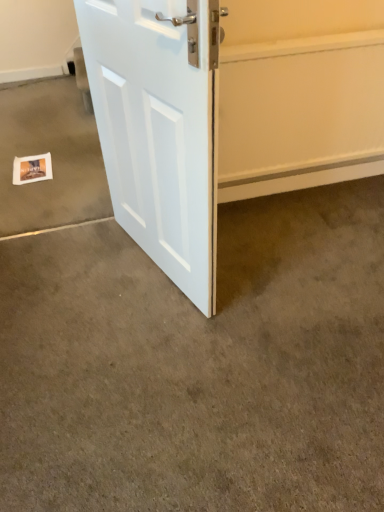
Question: Can you confirm if white paper postcard at lower left is taller than white smooth door at upper center?

Choices:
 (A) yes
 (B) no

Answer: (B)

Question: Considering the relative sizes of white paper postcard at lower left and white smooth door at upper center in the image provided, is white paper postcard at lower left thinner than white smooth door at upper center?

Choices:
 (A) no
 (B) yes

Answer: (A)

Question: Is white paper postcard at lower left far from white smooth door at upper center?

Choices:
 (A) no
 (B) yes

Answer: (B)

Question: Would you say white smooth door at upper center is part of white paper postcard at lower left's contents?

Choices:
 (A) yes
 (B) no

Answer: (B)

Question: Is white paper postcard at lower left at the right side of white smooth door at upper center?

Choices:
 (A) yes
 (B) no

Answer: (B)

Question: Is white paper postcard at lower left next to white smooth door at upper center and touching it?

Choices:
 (A) no
 (B) yes

Answer: (A)

Question: Can you confirm if white smooth door at upper center is smaller than white paper postcard at lower left?

Choices:
 (A) yes
 (B) no

Answer: (B)

Question: Is white smooth door at upper center positioned with its back to white paper postcard at lower left?

Choices:
 (A) no
 (B) yes

Answer: (A)

Question: Is white smooth door at upper center shorter than white paper postcard at lower left?

Choices:
 (A) yes
 (B) no

Answer: (B)

Question: Is white smooth door at upper center with white paper postcard at lower left?

Choices:
 (A) yes
 (B) no

Answer: (B)

Question: Is white smooth door at upper center positioned far away from white paper postcard at lower left?

Choices:
 (A) yes
 (B) no

Answer: (A)

Question: Is white smooth door at upper center aimed at white paper postcard at lower left?

Choices:
 (A) no
 (B) yes

Answer: (A)

Question: From a real-world perspective, is smooth carpet at center, positioned as the second concrete in back-to-front order, positioned over white paper postcard at lower left based on gravity?

Choices:
 (A) no
 (B) yes

Answer: (A)